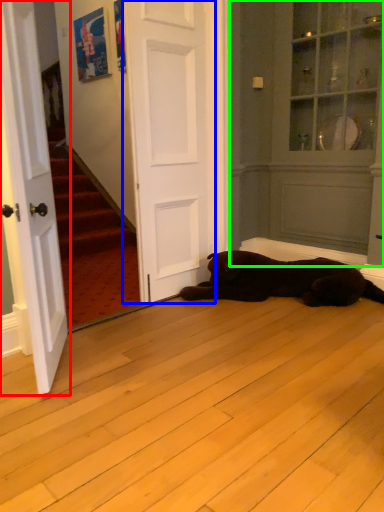
Question: Based on their relative distances, which object is nearer to door (highlighted by a red box)? Choose from door (highlighted by a blue box) and armoire (highlighted by a green box).

Choices:
 (A) door
 (B) armoire

Answer: (A)